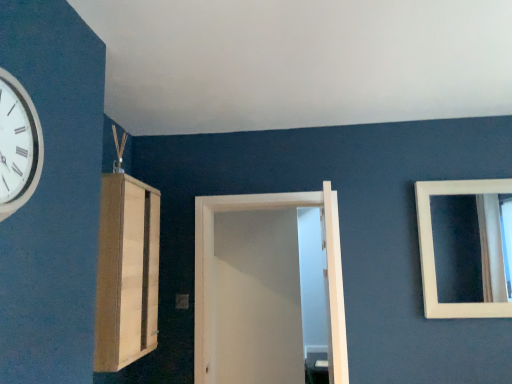
Identify the location of white matte mirror at upper right. This screenshot has width=512, height=384. (472, 247).

I want to click on white glossy clock at upper left, so click(x=18, y=145).

Image resolution: width=512 pixels, height=384 pixels. What do you see at coordinates (212, 268) in the screenshot? I see `white matte door at center` at bounding box center [212, 268].

You are a GUI agent. You are given a task and a screenshot of the screen. Output one action in this format:
    pyautogui.click(x=<x>, y=<y>)
    Task: Click on the white matte mirror at upper right
    The image size is (512, 384).
    Given the screenshot: What is the action you would take?
    pyautogui.click(x=472, y=247)

Does white glossy clock at upper left turn towards white matte door at center?

No.

Does point (1, 116) lie in front of point (210, 327)?

That is True.

Does white glossy clock at upper left contain white matte door at center?

No, white matte door at center is not a part of white glossy clock at upper left.

What's the angular difference between white glossy clock at upper left and white matte door at center's facing directions?

There is a 89.3-degree angle between the facing directions of white glossy clock at upper left and white matte door at center.

Considering the sizes of objects light wood cabinet at left and white matte door at center in the image provided, who is taller, light wood cabinet at left or white matte door at center?

white matte door at center is taller.

Can you confirm if light wood cabinet at left is positioned to the right of white matte door at center?

No, light wood cabinet at left is not to the right of white matte door at center.

Is light wood cabinet at left bigger than white matte door at center?

Incorrect, light wood cabinet at left is not larger than white matte door at center.

Is point (201, 354) behind point (473, 263)?

No.

Can we say white matte door at center lies outside white matte mirror at upper right?

Yes, white matte door at center is located beyond the bounds of white matte mirror at upper right.

Which of these two, white matte door at center or white matte mirror at upper right, stands shorter?

With less height is white matte mirror at upper right.

Who is bigger, white matte door at center or white matte mirror at upper right?

white matte door at center.

Which of these two, light wood cabinet at left or white matte mirror at upper right, stands shorter?

With less height is white matte mirror at upper right.

Consider the image. Is light wood cabinet at left thinner than white matte mirror at upper right?

No, light wood cabinet at left is not thinner than white matte mirror at upper right.

Is light wood cabinet at left positioned beyond the bounds of white matte mirror at upper right?

light wood cabinet at left is positioned outside white matte mirror at upper right.

From the image's perspective, is light wood cabinet at left beneath white matte mirror at upper right?

Correct, light wood cabinet at left appears lower than white matte mirror at upper right in the image.

Would you consider white matte mirror at upper right to be distant from white glossy clock at upper left?

white matte mirror at upper right is positioned a significant distance from white glossy clock at upper left.

Which of these two, white matte mirror at upper right or white glossy clock at upper left, is smaller?

white glossy clock at upper left.

Is point (440, 296) positioned in front of point (0, 215)?

No, it is behind (0, 215).

From a real-world perspective, is white matte mirror at upper right on top of white glossy clock at upper left?

No, from a real-world perspective, white matte mirror at upper right is not on top of white glossy clock at upper left.

From a real-world perspective, which is physically above, white matte door at center or white glossy clock at upper left?

From a 3D spatial view, white glossy clock at upper left is above.

In the scene shown: Considering the relative sizes of white matte door at center and white glossy clock at upper left in the image provided, is white matte door at center bigger than white glossy clock at upper left?

Correct, white matte door at center is larger in size than white glossy clock at upper left.

How far apart are white matte door at center and white glossy clock at upper left?

white matte door at center is 5.61 feet away from white glossy clock at upper left.

Would you say white matte door at center is outside white glossy clock at upper left?

Yes, white matte door at center is not within white glossy clock at upper left.

Is white matte mirror at upper right positioned in front of light wood cabinet at left?

No, white matte mirror at upper right is behind light wood cabinet at left.

This screenshot has height=384, width=512. I want to click on cabinetry that appears in front of the white matte mirror at upper right, so click(126, 272).

Who is bigger, white matte mirror at upper right or light wood cabinet at left?

light wood cabinet at left is bigger.

In the scene shown: Which is farther from the camera, (472, 226) or (127, 308)?

The point (472, 226) is more distant.

The image size is (512, 384). In order to click on door below the white glossy clock at upper left (from a real-world perspective) in this screenshot , I will do `click(212, 268)`.

Where is `cabinetry on the left of white matte door at center`? The width and height of the screenshot is (512, 384). cabinetry on the left of white matte door at center is located at coordinates (126, 272).

Considering their positions, is white matte mirror at upper right positioned further to white glossy clock at upper left than light wood cabinet at left?

white matte mirror at upper right.

When comparing their distances from white matte mirror at upper right, does light wood cabinet at left or white glossy clock at upper left seem closer?

light wood cabinet at left.

Considering their positions, is white matte door at center positioned further to white glossy clock at upper left than light wood cabinet at left?

Based on the image, white matte door at center appears to be further to white glossy clock at upper left.

Estimate the real-world distances between objects in this image. Which object is closer to light wood cabinet at left, white matte mirror at upper right or white glossy clock at upper left?

white glossy clock at upper left is positioned closer to the anchor light wood cabinet at left.

Looking at the image, which one is located closer to white matte mirror at upper right, white matte door at center or light wood cabinet at left?

white matte door at center is positioned closer to the anchor white matte mirror at upper right.

Based on their spatial positions, is white glossy clock at upper left or white matte door at center further from light wood cabinet at left?

The object further to light wood cabinet at left is white glossy clock at upper left.

When comparing their distances from white matte door at center, does light wood cabinet at left or white matte mirror at upper right seem further?

white matte mirror at upper right lies further to white matte door at center than the other object.

Estimate the real-world distances between objects in this image. Which object is further from light wood cabinet at left, white matte mirror at upper right or white matte door at center?

Based on the image, white matte mirror at upper right appears to be further to light wood cabinet at left.

The height and width of the screenshot is (384, 512). I want to click on cabinetry positioned between white glossy clock at upper left and white matte door at center from near to far, so click(126, 272).

Locate an element on the screen. The height and width of the screenshot is (384, 512). door between white glossy clock at upper left and white matte mirror at upper right is located at coordinates (212, 268).

The image size is (512, 384). I want to click on wall clock located between light wood cabinet at left and white matte mirror at upper right in the left-right direction, so click(18, 145).

Locate an element on the screen. This screenshot has height=384, width=512. door located between light wood cabinet at left and white matte mirror at upper right in the left-right direction is located at coordinates (212, 268).